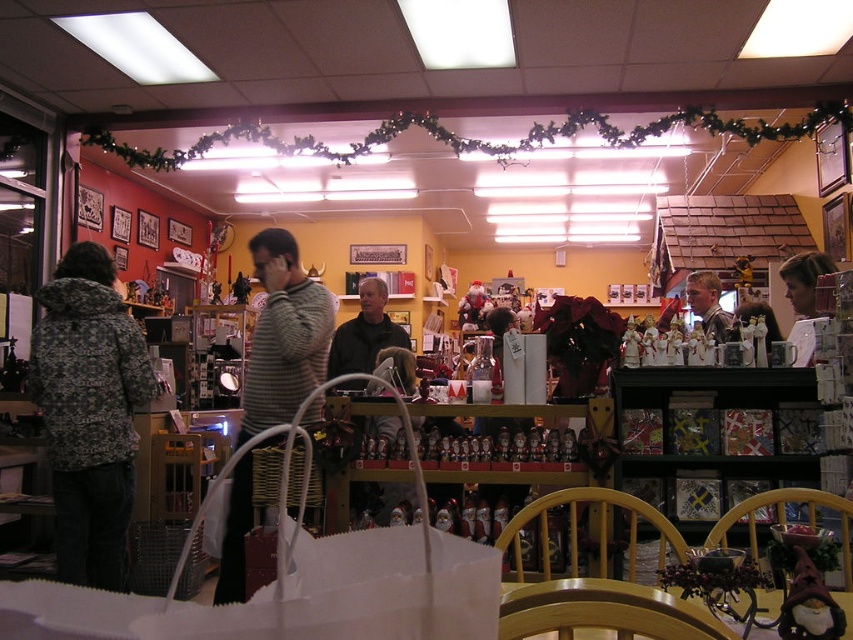
You are a customer in the store looking for a jacket. You see the patterned fabric jacket at left and the dark gray sweater at center. Which item is positioned lower on the shelf?

The patterned fabric jacket at left is positioned below the dark gray sweater at center, so it is lower on the shelf.

You are standing in the store and see two points marked on the ceiling garland. The first point is at coordinates point (109, 420) and the second point is at point (300, 401). Which point is closer to you?

Point (300, 401) is closer to you because it is in front of point (109, 420).

You are a customer in the store and want to pick up the striped sweater at center. Can you reach it without moving the smooth gray sweater at center?

The striped sweater at center is positioned under the smooth gray sweater at center, so you can reach it without moving the smooth gray sweater at center by lifting it from underneath.